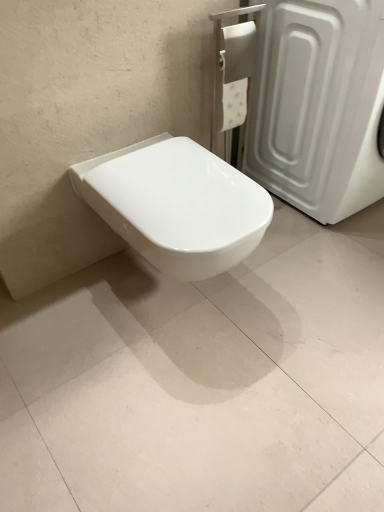
Locate an element on the screen. Image resolution: width=384 pixels, height=512 pixels. vacant space situated above white glossy toilet at center (from a real-world perspective) is located at coordinates [x=235, y=333].